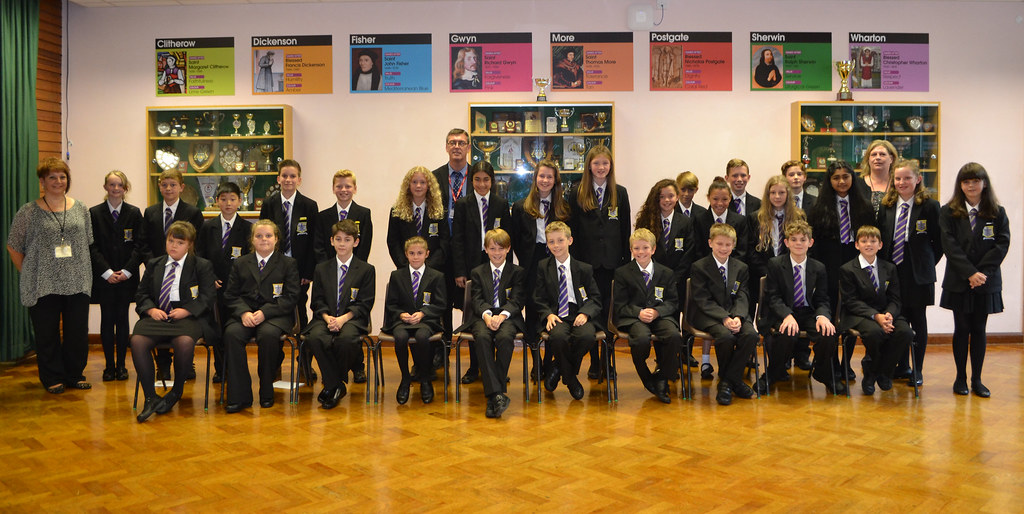
Where is `wall poster`? Image resolution: width=1024 pixels, height=514 pixels. wall poster is located at coordinates (186, 67), (294, 60), (403, 64), (497, 60), (596, 60), (691, 62), (792, 54), (882, 64).